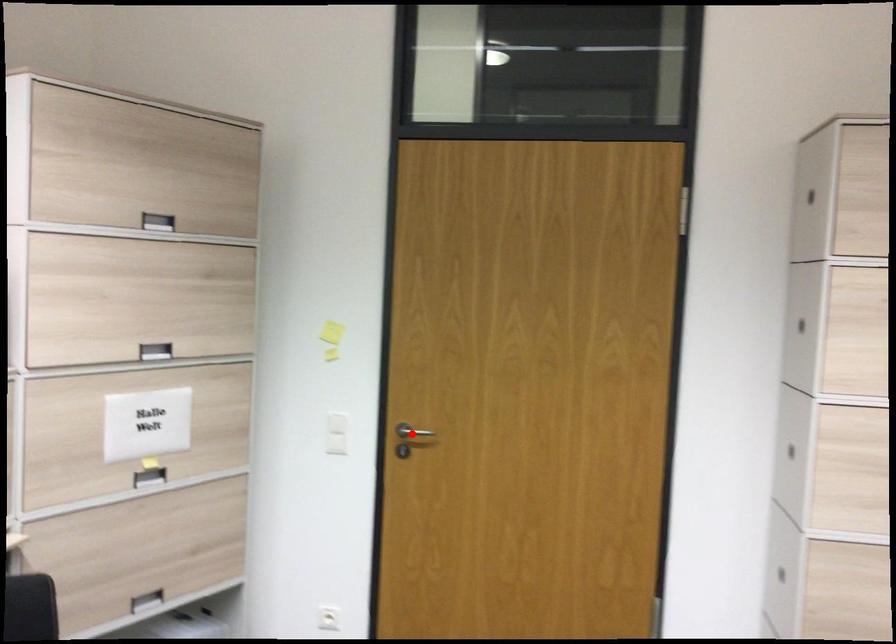
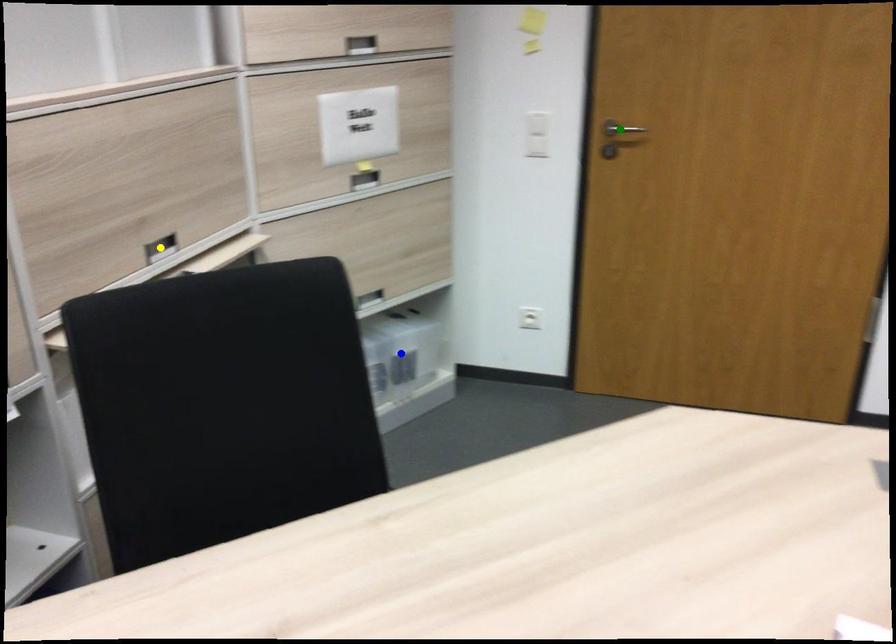
Question: I am providing you with two images of the same scene from different viewpoints. A red point is marked on the first image. You are given multiple points on the second image. Which point in image 2 is actually the same real-world point as the red point in image 1?

Choices:
 (A) green point
 (B) yellow point
 (C) blue point

Answer: (A)